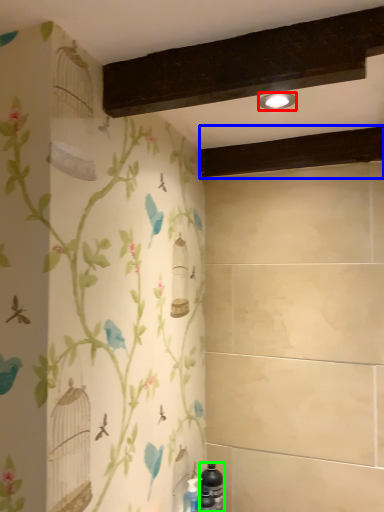
Question: Estimate the real-world distances between objects in this image. Which object is farther from light fixture (highlighted by a red box), plank (highlighted by a blue box) or bottle (highlighted by a green box)?

Choices:
 (A) plank
 (B) bottle

Answer: (B)